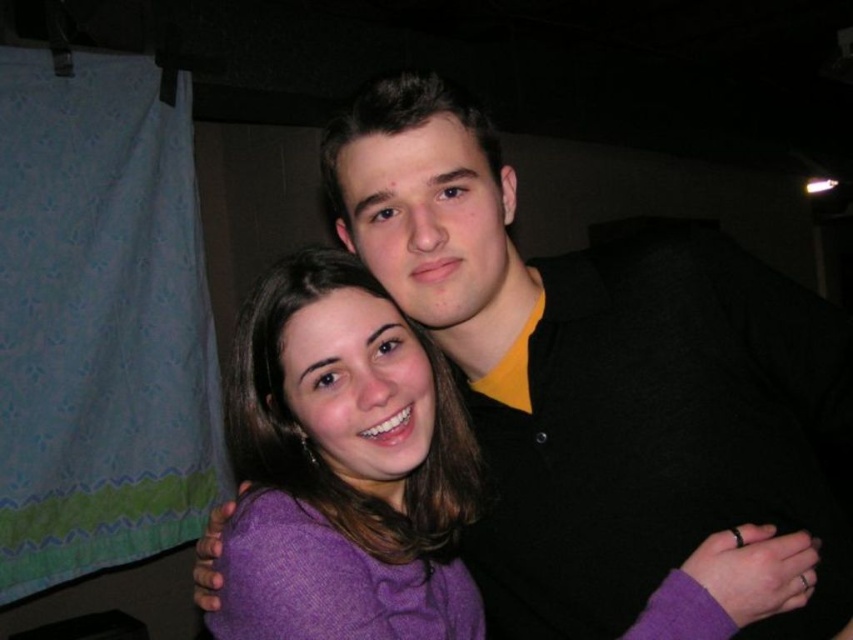
You are at a party and need to locate two people wearing specific clothing items. The black matte shirt at upper center and the purple wool sweater at center are both in the scene. Which one is positioned more to the right side?

The black matte shirt at upper center is to the right of the purple wool sweater at center, so the black matte shirt at upper center is positioned more to the right side.

You are a photographer trying to adjust the lighting for a portrait. You notice the black matte shirt at upper center and the purple wool sweater at center in the frame. Which clothing item should you focus your spotlight on to ensure it stands out more due to its position?

The black matte shirt at upper center is taller than the purple wool sweater at center, so focusing the spotlight on the black matte shirt at upper center would make it stand out more because of its higher position in the frame.